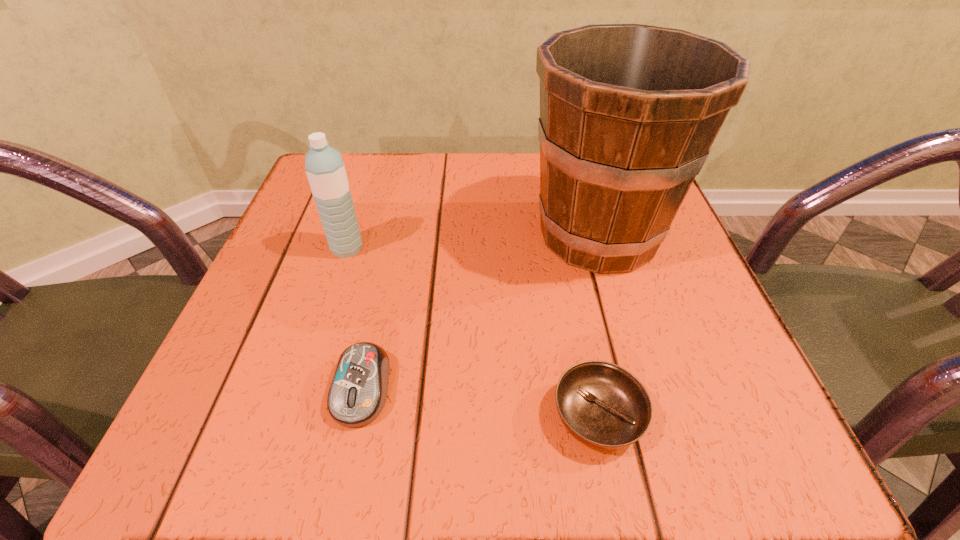
Locate an element on the screen. unoccupied area between the leftmost object and the soup bowl is located at coordinates (472, 332).

Image resolution: width=960 pixels, height=540 pixels. I want to click on vacant point located between the computer mouse and the soup bowl, so click(x=480, y=402).

Select which object appears as the second closest to the soup bowl. Please provide its 2D coordinates. Your answer should be formatted as a tuple, i.e. [(x, y)], where the tuple contains the x and y coordinates of a point satisfying the conditions above.

[(358, 392)]

At what (x,y) coordinates should I click in order to perform the action: click on object that ranks as the third closest to the leftmost object. Please return your answer as a coordinate pair (x, y). This screenshot has height=540, width=960. Looking at the image, I should click on (602, 405).